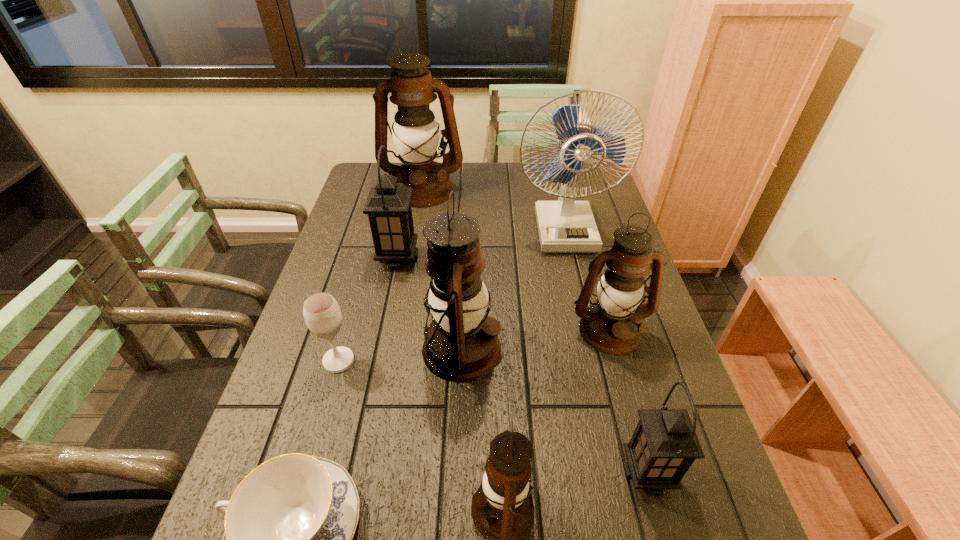
The image size is (960, 540). Find the location of `object present at the far left corner`. object present at the far left corner is located at coordinates (415, 133).

The height and width of the screenshot is (540, 960). I want to click on free space at the left edge of the desktop, so click(x=270, y=455).

At what (x,y) coordinates should I click in order to perform the action: click on vacant region at the right edge of the desktop. Please return your answer as a coordinate pair (x, y). Image resolution: width=960 pixels, height=540 pixels. Looking at the image, I should click on (647, 516).

Where is `empty space that is in between the fan and the farther black lantern`? The height and width of the screenshot is (540, 960). empty space that is in between the fan and the farther black lantern is located at coordinates (481, 243).

Where is `free spot between the rightmost brown lantern and the second biggest brown lantern`? free spot between the rightmost brown lantern and the second biggest brown lantern is located at coordinates (536, 340).

Identify the location of vacant space in between the blue fan and the fifth shortest lantern. (513, 288).

Where is `free area in between the third biggest brown lantern and the second biggest brown lantern`? This screenshot has height=540, width=960. free area in between the third biggest brown lantern and the second biggest brown lantern is located at coordinates (536, 340).

At what (x,y) coordinates should I click in order to perform the action: click on object that is the sixth closest to the right black lantern. Please return your answer as a coordinate pair (x, y). This screenshot has width=960, height=540. Looking at the image, I should click on pyautogui.click(x=565, y=226).

You are a GUI agent. You are given a task and a screenshot of the screen. Output one action in this format:
    pyautogui.click(x=<x>, y=<y>)
    Task: Click on the object that is the seventh closest one to the wineglass
    
    Given the screenshot: What is the action you would take?
    pyautogui.click(x=415, y=133)

Locate an element on the screen. lantern that is the nearest to the nearest brown lantern is located at coordinates (458, 299).